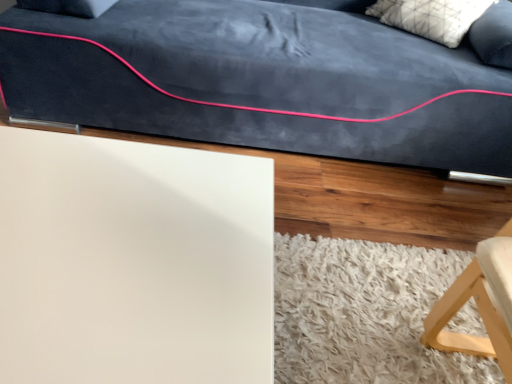
Question: Is white shaggy rug at lower right oriented away from white matte board at lower left?

Choices:
 (A) no
 (B) yes

Answer: (A)

Question: From the image's perspective, does white shaggy rug at lower right appear lower than white matte board at lower left?

Choices:
 (A) yes
 (B) no

Answer: (A)

Question: Is white shaggy rug at lower right outside white matte board at lower left?

Choices:
 (A) no
 (B) yes

Answer: (B)

Question: Considering the relative sizes of white shaggy rug at lower right and white matte board at lower left in the image provided, is white shaggy rug at lower right shorter than white matte board at lower left?

Choices:
 (A) no
 (B) yes

Answer: (B)

Question: From a real-world perspective, is white shaggy rug at lower right physically below white matte board at lower left?

Choices:
 (A) yes
 (B) no

Answer: (A)

Question: Could white matte board at lower left be considered to be inside white shaggy rug at lower right?

Choices:
 (A) yes
 (B) no

Answer: (B)

Question: From the image's perspective, is white textured pillow at upper right located above white matte board at lower left?

Choices:
 (A) no
 (B) yes

Answer: (B)

Question: Is white textured pillow at upper right turned away from white matte board at lower left?

Choices:
 (A) yes
 (B) no

Answer: (B)

Question: Does white textured pillow at upper right appear on the left side of white matte board at lower left?

Choices:
 (A) yes
 (B) no

Answer: (B)

Question: Is white textured pillow at upper right placed right next to white matte board at lower left?

Choices:
 (A) no
 (B) yes

Answer: (A)

Question: Can you confirm if white textured pillow at upper right is smaller than white matte board at lower left?

Choices:
 (A) no
 (B) yes

Answer: (B)

Question: Is white textured pillow at upper right not within white matte board at lower left?

Choices:
 (A) no
 (B) yes

Answer: (B)

Question: From the image's perspective, is white matte board at lower left above white shaggy rug at lower right?

Choices:
 (A) no
 (B) yes

Answer: (B)